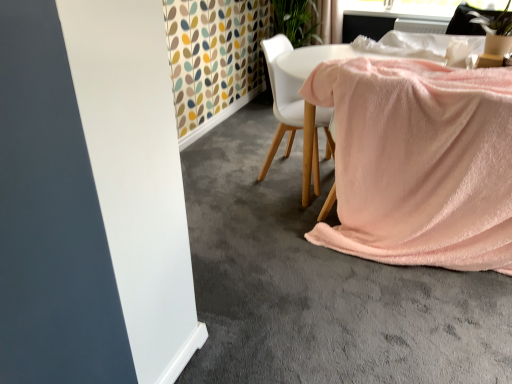
The height and width of the screenshot is (384, 512). I want to click on vacant region to the left of white fabric chair at center, so click(x=229, y=174).